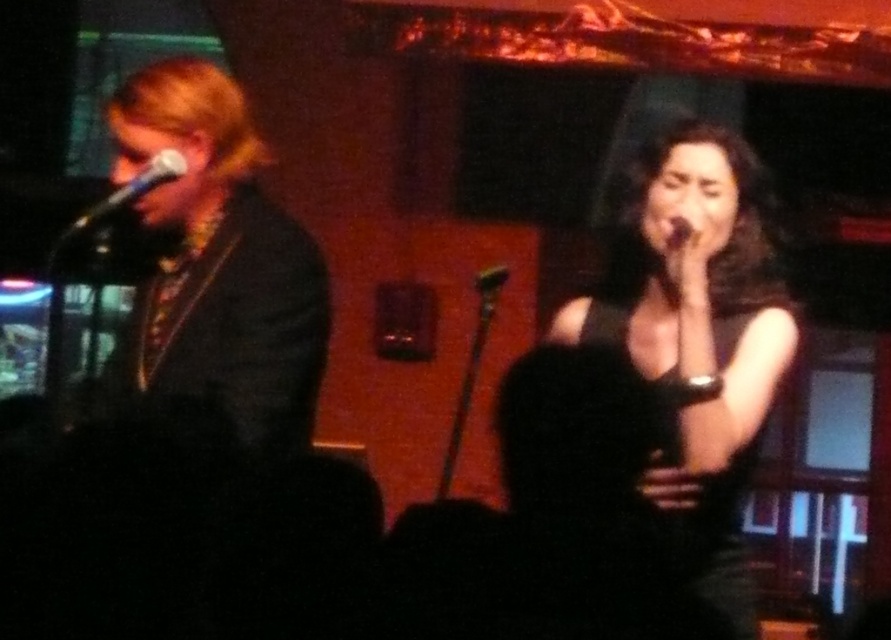
Consider the image. You are a photographer at the venue and need to capture a photo where both the black matte dress at center and the shiny black jacket at left are visible. However, you notice that one of the items is much taller than the other. Which item should you position closer to the camera to ensure both are fully visible in the frame?

The black matte dress at center is much taller than the shiny black jacket at left. To ensure both are fully visible in the frame, position the shiny black jacket at left closer to the camera since it is shorter and requires less vertical space.

You are a photographer setting up for a live performance. You need to ensure that the black matte dress at center and the metallic silver microphone at left are both visible in your shot. Considering their sizes, which object should you focus on first to ensure it doesn

The black matte dress at center is taller than the metallic silver microphone at left, so you should focus on the black matte dress at center first to ensure it is in clear view before adjusting for the microphone.

You are a stagehand who needs to move a 28 inch wide equipment cart from the left side of the stage to the right side. There is a path between the black matte dress at center and the shiny black jacket at left. Can the cart fit through this path?

The distance between the black matte dress at center and the shiny black jacket at left is 31.00 inches. Since the equipment cart is 28 inches wide, it can fit through the path as there is enough space.